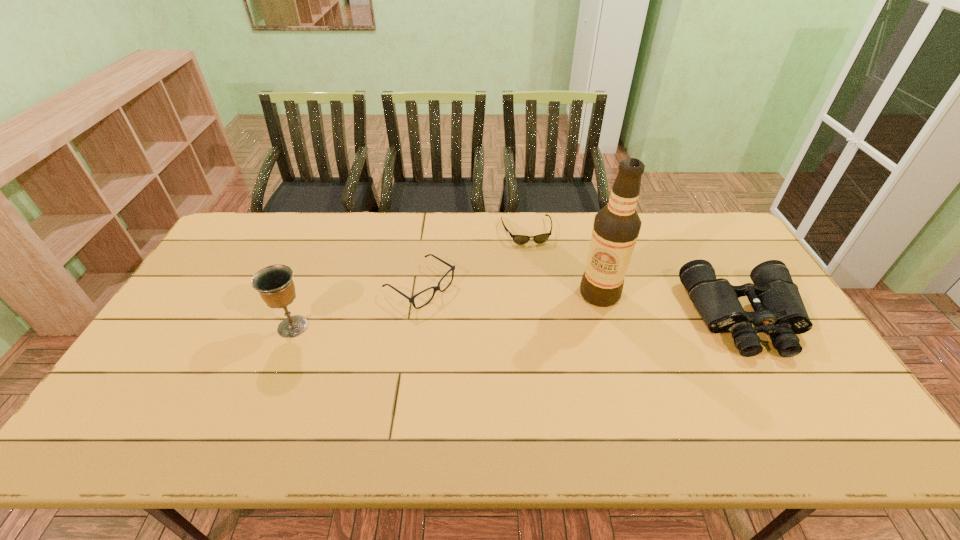
Image resolution: width=960 pixels, height=540 pixels. What are the coordinates of `unoccupied position between the leftmost object and the rightmost object` in the screenshot? It's located at (518, 322).

What are the coordinates of `vacant space that's between the third object from left to right and the tallest object` in the screenshot? It's located at (563, 262).

I want to click on free space that is in between the alcohol and the chalice, so click(x=446, y=310).

The height and width of the screenshot is (540, 960). Find the location of `free space between the tallest object and the third shortest object`. free space between the tallest object and the third shortest object is located at coordinates (672, 306).

You are a GUI agent. You are given a task and a screenshot of the screen. Output one action in this format:
    pyautogui.click(x=<x>, y=<y>)
    Task: Click on the vacant area that lies between the rightmost object and the leftmost object
    The image size is (960, 540).
    Given the screenshot: What is the action you would take?
    pyautogui.click(x=518, y=322)

Identify the location of empty location between the binoculars and the farthest object. (636, 274).

Find the location of `vacant area that lies between the spectacles and the fourth object from left to right`. vacant area that lies between the spectacles and the fourth object from left to right is located at coordinates (510, 290).

Where is `unoccupied position between the shortest object and the fourth object from left to right`? unoccupied position between the shortest object and the fourth object from left to right is located at coordinates (563, 262).

Locate which object is the third closest to the binoculars. Please provide its 2D coordinates. Your answer should be formatted as a tuple, i.e. [(x, y)], where the tuple contains the x and y coordinates of a point satisfying the conditions above.

[(435, 288)]

Locate which object is the third closest to the spectacles. Please provide its 2D coordinates. Your answer should be formatted as a tuple, i.e. [(x, y)], where the tuple contains the x and y coordinates of a point satisfying the conditions above.

[(616, 227)]